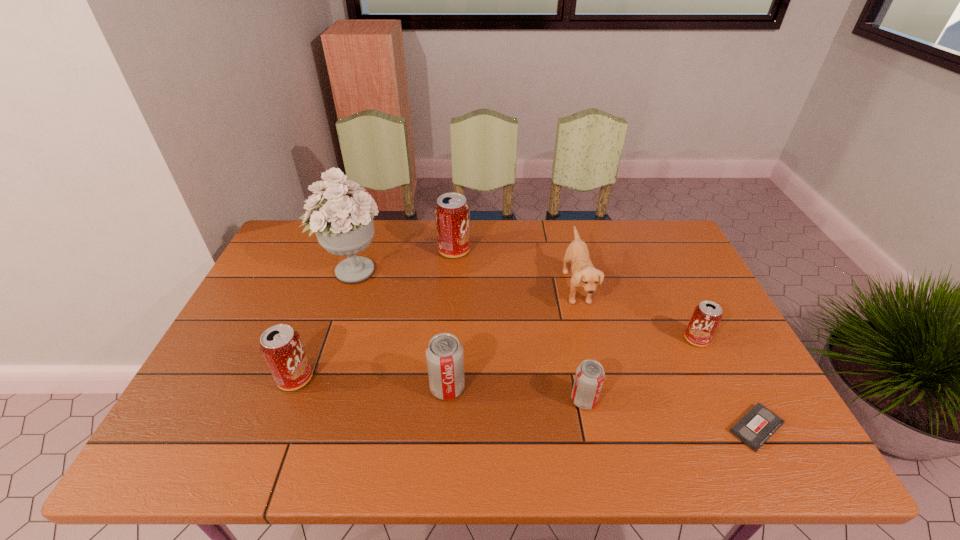
Locate an element on the screen. Image resolution: width=960 pixels, height=540 pixels. bouquet is located at coordinates (344, 226).

Where is `the tallest object`? The width and height of the screenshot is (960, 540). the tallest object is located at coordinates (344, 226).

The width and height of the screenshot is (960, 540). Find the location of `the farthest soda can`. the farthest soda can is located at coordinates (452, 213).

Find the location of a particular element. the farthest red soda can is located at coordinates (452, 213).

This screenshot has height=540, width=960. What are the coordinates of `beige puppy` in the screenshot? It's located at (584, 275).

The height and width of the screenshot is (540, 960). I want to click on the bigger gray soda can, so click(x=445, y=358).

I want to click on the second biggest red soda can, so click(281, 347).

Identify the location of the nearest red soda can. The height and width of the screenshot is (540, 960). (281, 347).

The height and width of the screenshot is (540, 960). I want to click on the rightmost soda can, so click(706, 317).

Find the location of `the second farthest soda can`. the second farthest soda can is located at coordinates pyautogui.click(x=706, y=317).